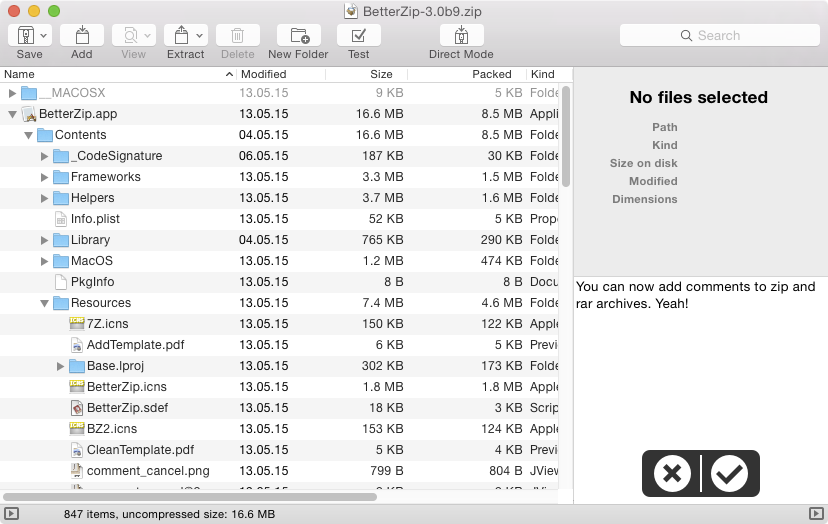
Find the location of a particular element. The height and width of the screenshot is (524, 828). folder is located at coordinates (23, 93), (45, 139), (59, 158), (58, 185), (59, 199), (60, 242), (60, 262), (56, 305), (75, 366).